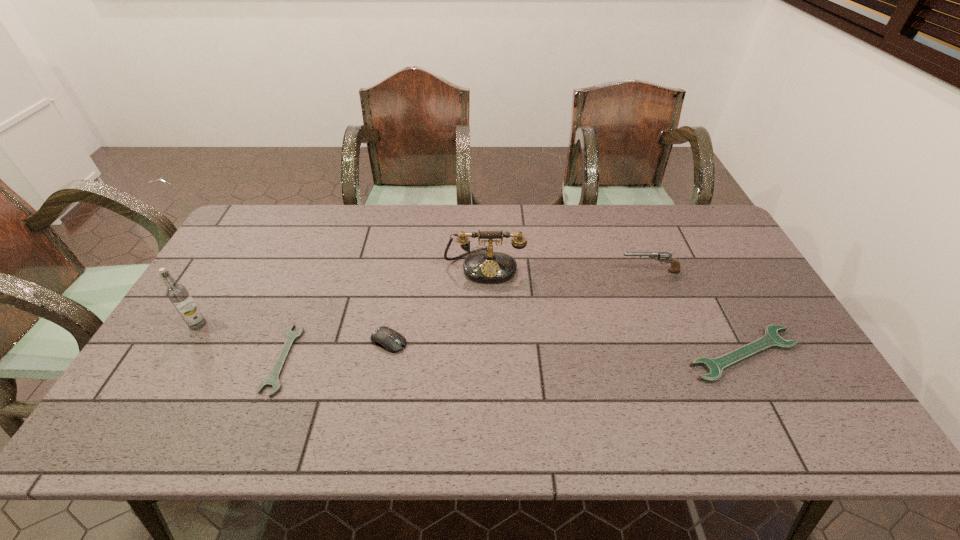
Locate an element on the screen. unoccupied position between the leftmost object and the fifth shortest object is located at coordinates (341, 295).

The image size is (960, 540). Find the location of `unoccupied position between the fourth shortest object and the taller wrench`. unoccupied position between the fourth shortest object and the taller wrench is located at coordinates (696, 313).

Where is `free space between the shorter wrench and the fourth object from right to left`? The width and height of the screenshot is (960, 540). free space between the shorter wrench and the fourth object from right to left is located at coordinates (336, 350).

You are a GUI agent. You are given a task and a screenshot of the screen. Output one action in this format:
    pyautogui.click(x=<x>, y=<y>)
    Task: Click on the vacant area that lies between the gun and the left wrench
    
    Given the screenshot: What is the action you would take?
    pyautogui.click(x=467, y=315)

Where is `free point between the fifth object from right to left and the computer equipment`? Image resolution: width=960 pixels, height=540 pixels. free point between the fifth object from right to left and the computer equipment is located at coordinates (336, 350).

Locate an element on the screen. Image resolution: width=960 pixels, height=540 pixels. vacant point located between the left wrench and the third tallest object is located at coordinates [467, 315].

Locate an element on the screen. free space that is in between the computer equipment and the fourth object from left to right is located at coordinates (437, 303).

The height and width of the screenshot is (540, 960). I want to click on free space between the gun and the right wrench, so click(696, 313).

The image size is (960, 540). I want to click on the third closest object to the fourth object from left to right, so click(x=273, y=380).

Identify which object is the third closest to the tallest object. Please provide its 2D coordinates. Your answer should be formatted as a tuple, i.e. [(x, y)], where the tuple contains the x and y coordinates of a point satisfying the conditions above.

[(484, 267)]